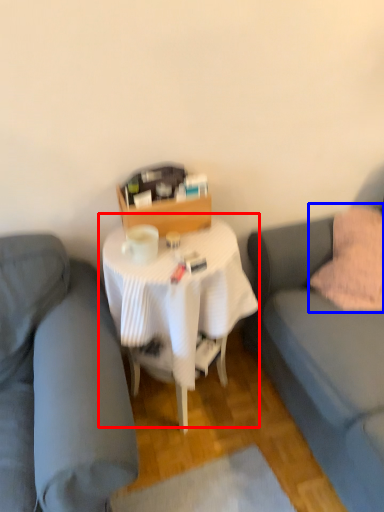
Question: Which object appears closest to the camera in this image, table (highlighted by a red box) or throw pillow (highlighted by a blue box)?

Choices:
 (A) table
 (B) throw pillow

Answer: (A)